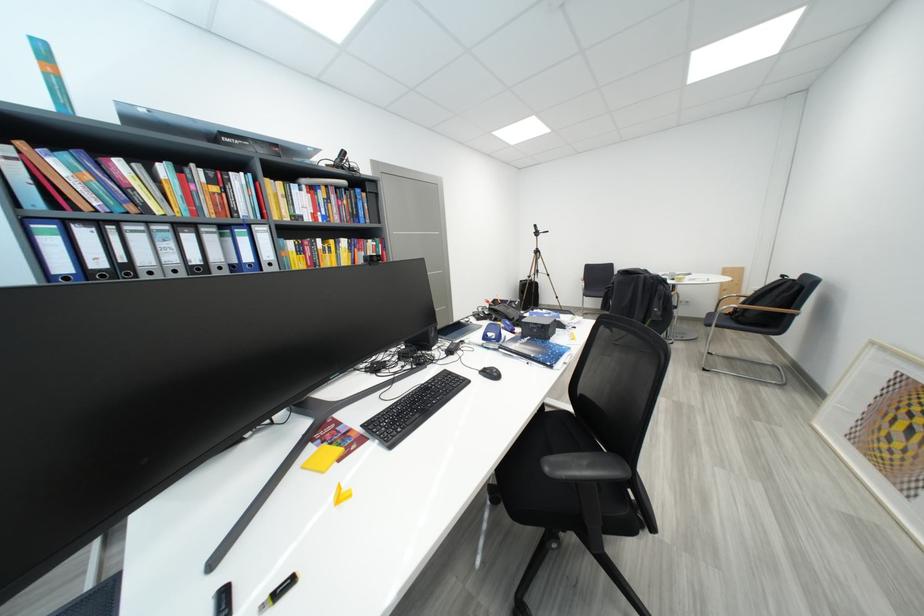
This screenshot has height=616, width=924. Describe the element at coordinates (210, 132) in the screenshot. I see `the utility knife slider` at that location.